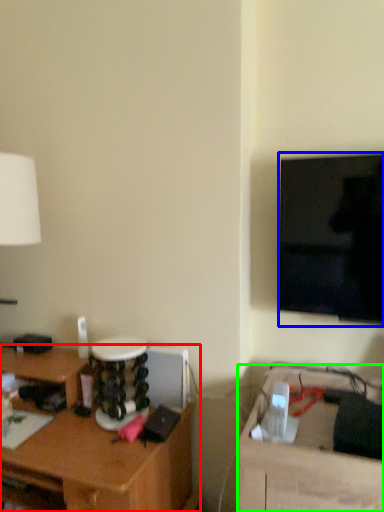
Question: Based on their relative distances, which object is nearer to desk (highlighted by a red box)? Choose from television (highlighted by a blue box) and table (highlighted by a green box).

Choices:
 (A) television
 (B) table

Answer: (B)